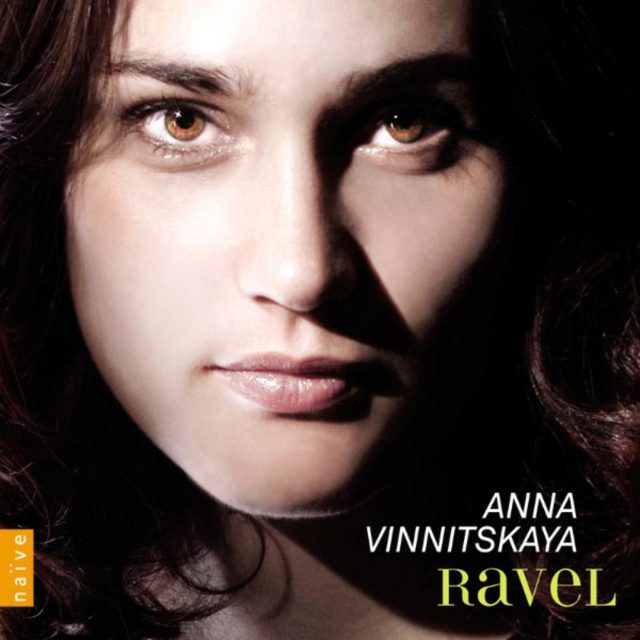
Question: Which object is positioned closest to the smooth skin face at center?

Choices:
 (A) brown glossy eye at upper center
 (B) brown matte eye at upper left

Answer: (B)

Question: Does brown glossy eye at upper center have a greater width compared to brown matte eye at upper left?

Choices:
 (A) no
 (B) yes

Answer: (B)

Question: Can you confirm if brown glossy eye at upper center is thinner than brown matte eye at upper left?

Choices:
 (A) yes
 (B) no

Answer: (B)

Question: Among these objects, which one is farthest from the camera?

Choices:
 (A) brown glossy eye at upper center
 (B) smooth skin face at center

Answer: (A)

Question: Is brown glossy eye at upper center smaller than brown matte eye at upper left?

Choices:
 (A) yes
 (B) no

Answer: (B)

Question: Estimate the real-world distances between objects in this image. Which object is farther from the brown matte eye at upper left?

Choices:
 (A) brown glossy eye at upper center
 (B) smooth skin face at center

Answer: (A)